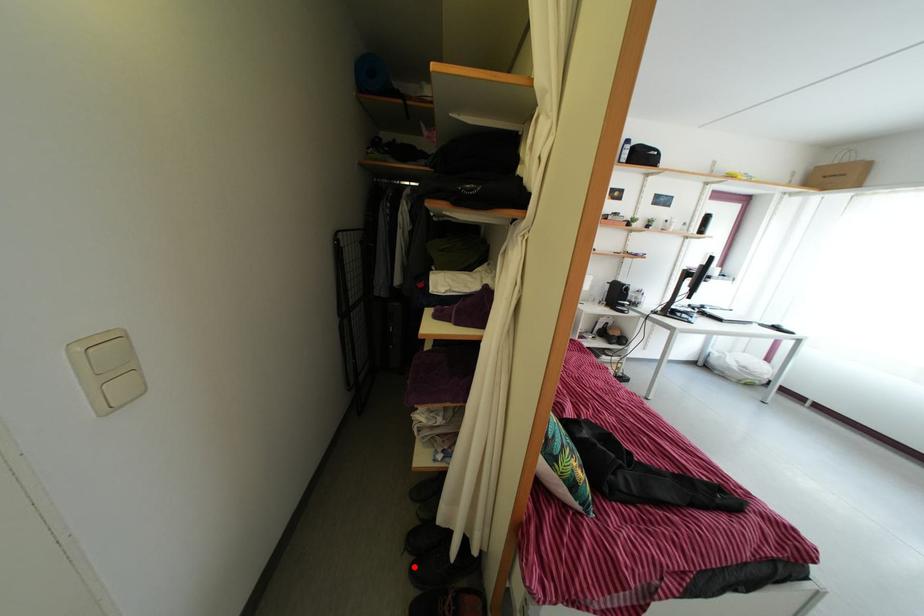
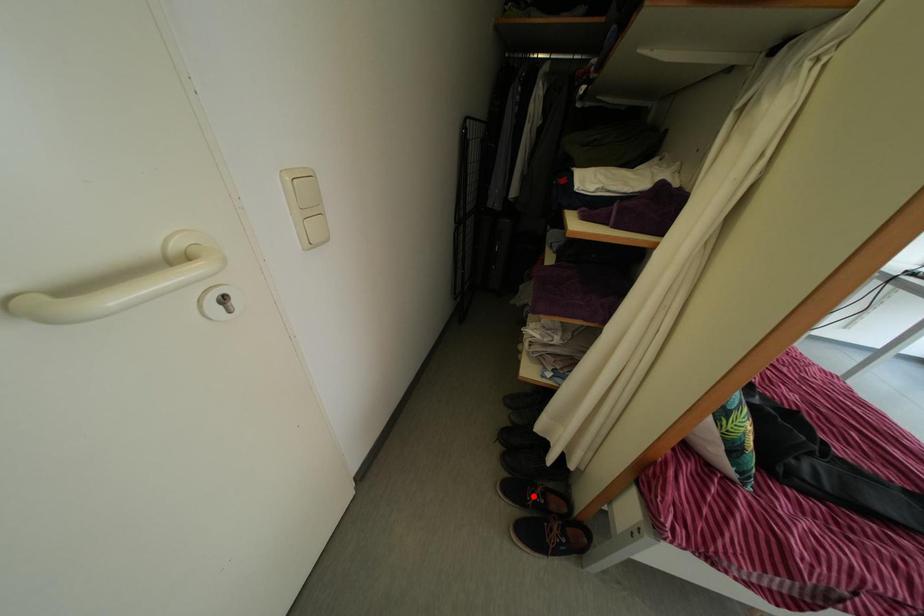
I am providing you with two images of the same scene from different viewpoints. A red point is marked on the first image and another point is marked on the second image. Do the highlighted points in image1 and image2 indicate the same real-world spot?

No